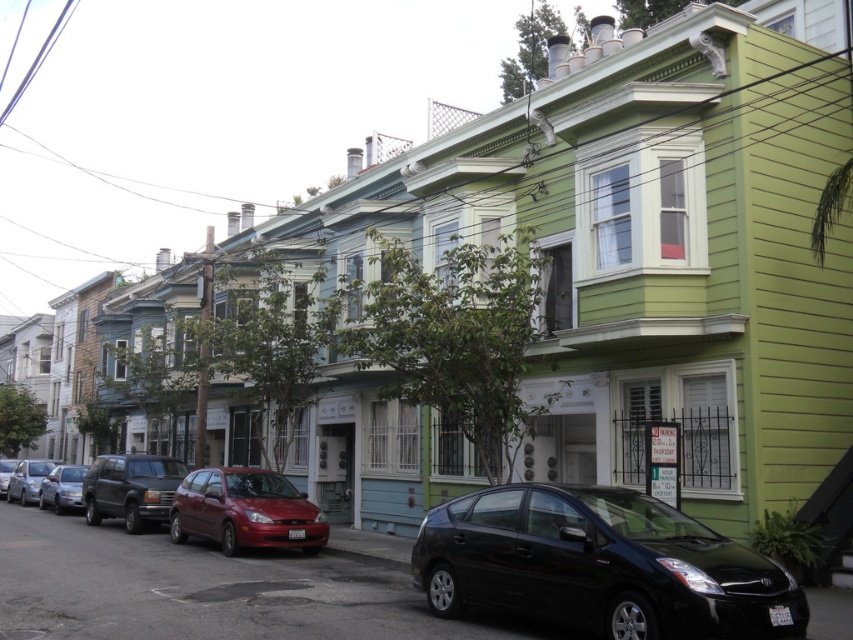
Which is below, black glossy car at lower right or metallic silver sedan at center-left?

metallic silver sedan at center-left is lower down.

What are the coordinates of `black glossy car at lower right` in the screenshot? It's located at (601, 564).

Between shiny red hatchback at center and metallic silver sedan at center-left, which one appears on the left side from the viewer's perspective?

Positioned to the left is metallic silver sedan at center-left.

In the scene shown: Is shiny red hatchback at center bigger than metallic silver sedan at center-left?

Correct, shiny red hatchback at center is larger in size than metallic silver sedan at center-left.

You are a GUI agent. You are given a task and a screenshot of the screen. Output one action in this format:
    pyautogui.click(x=<x>, y=<y>)
    Task: Click on the shiny red hatchback at center
    The image size is (853, 640).
    Given the screenshot: What is the action you would take?
    pyautogui.click(x=245, y=509)

Between shiny red hatchback at center and metallic silver sedan at left, which one has less height?

Standing shorter between the two is metallic silver sedan at left.

From the picture: Is shiny red hatchback at center above metallic silver sedan at left?

Yes, shiny red hatchback at center is above metallic silver sedan at left.

Which is in front, point (228, 518) or point (10, 484)?

Point (228, 518) is in front.

Identify the location of shiny red hatchback at center. (245, 509).